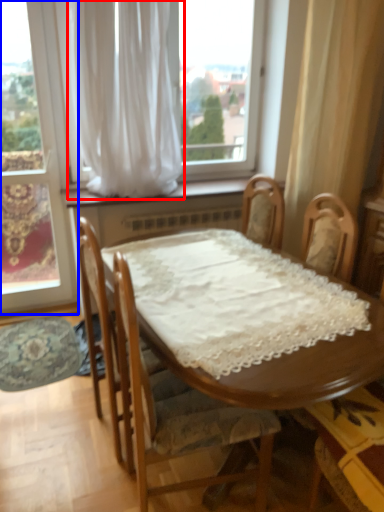
Question: Which point is further to the camera, curtain (highlighted by a red box) or window (highlighted by a blue box)?

Choices:
 (A) curtain
 (B) window

Answer: (B)